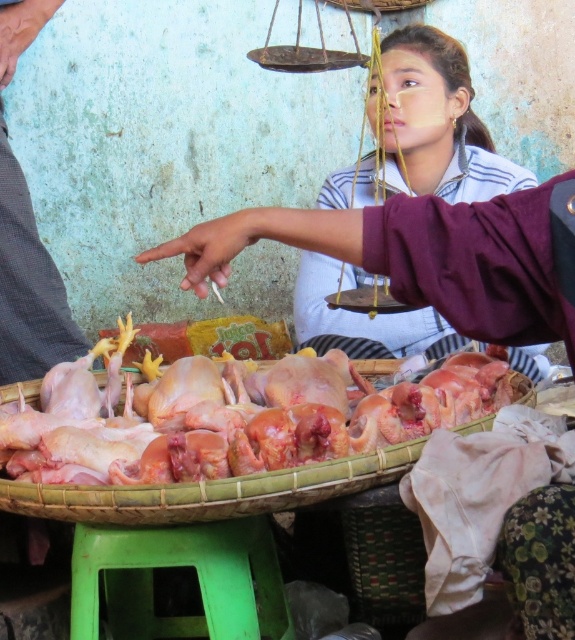
Question: Is raw pink meat at center bigger than metallic scale at upper center?

Choices:
 (A) yes
 (B) no

Answer: (B)

Question: Which object appears farthest from the camera in this image?

Choices:
 (A) metallic scale at upper center
 (B) blue striped shirt at center

Answer: (A)

Question: Which point is closer to the camera?

Choices:
 (A) green plastic stool at lower center
 (B) raw pink meat at center

Answer: (B)

Question: Estimate the real-world distances between objects in this image. Which object is farther from the metallic scale at upper center?

Choices:
 (A) raw pink meat at center
 (B) green plastic stool at lower center

Answer: (B)

Question: Can you confirm if raw pink meat at center is thinner than blue striped shirt at center?

Choices:
 (A) no
 (B) yes

Answer: (A)

Question: Is blue striped shirt at center bigger than green plastic stool at lower center?

Choices:
 (A) no
 (B) yes

Answer: (B)